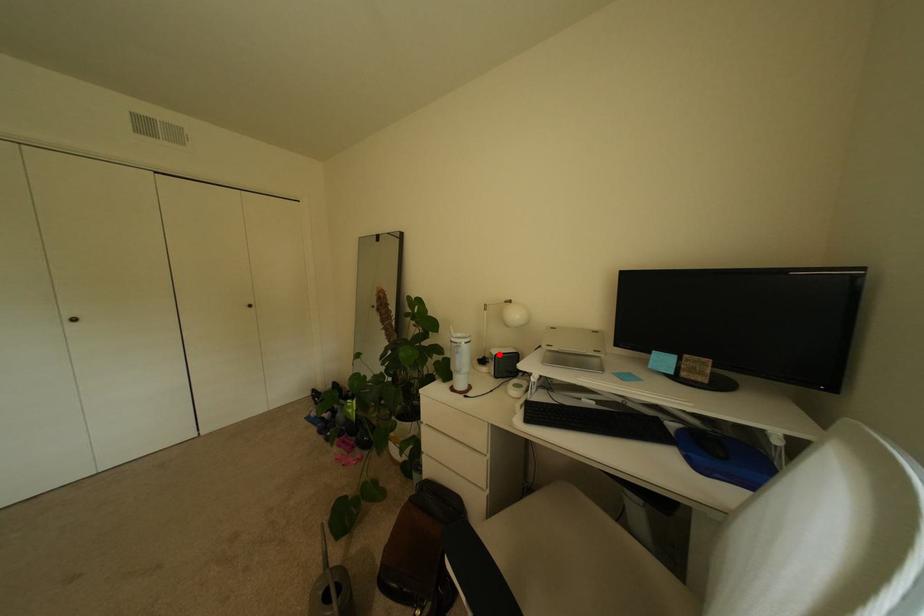
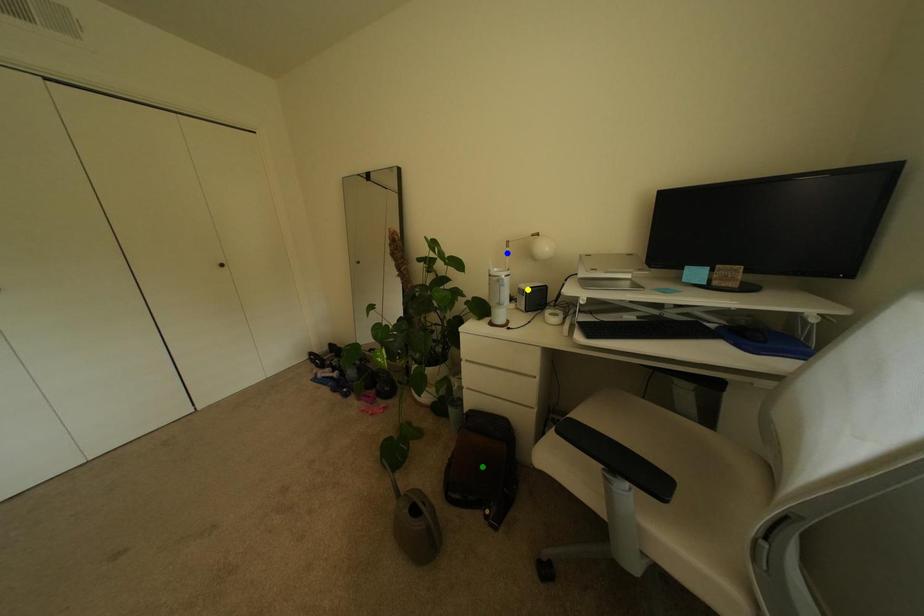
Question: I am providing you with two images of the same scene from different viewpoints. A red point is marked on the first image. You are given multiple points on the second image. Which spot in image 2 lines up with the point in image 1?

Choices:
 (A) yellow point
 (B) blue point
 (C) green point

Answer: (A)